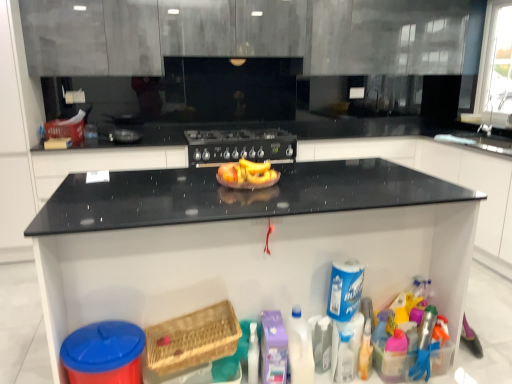
Question: Is woven wood basket at lower center inside or outside of metallic silver toaster at center, which is the 1th appliance in back-to-front order?

Choices:
 (A) inside
 (B) outside

Answer: (B)

Question: In terms of width, does woven wood basket at lower center look wider or thinner when compared to metallic silver toaster at center, arranged as the first appliance when viewed from the top?

Choices:
 (A) wide
 (B) thin

Answer: (A)

Question: Which object is positioned closest to the translucent plastic toy at lower right?

Choices:
 (A) black matte gas stove at center
 (B) black granite countertop at center
 (C) metallic silver toaster at center, which is the 2th appliance from front to back
 (D) shiny yellow bananas at center
 (E) white matte cabinet at right, placed as the second cabinetry when sorted from left to right

Answer: (B)

Question: Estimate the real-world distances between objects in this image. Which object is farther from the black granite countertop at center?

Choices:
 (A) matte gray cabinets at upper center, the 1th cabinetry from the left
 (B) white plastic bottle at lower right
 (C) white matte cabinet at right, placed as the second cabinetry when sorted from left to right
 (D) metallic silver toaster at center, positioned as the second appliance in bottom-to-top order
 (E) translucent plastic toy at lower right

Answer: (A)